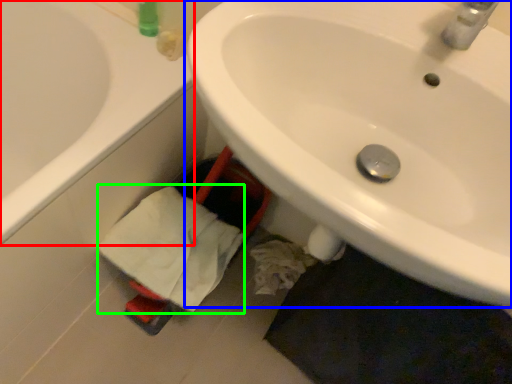
Question: Which object is the closest to the bathtub (highlighted by a red box)? Choose among these: sink (highlighted by a blue box) or bath towel (highlighted by a green box).

Choices:
 (A) sink
 (B) bath towel

Answer: (B)